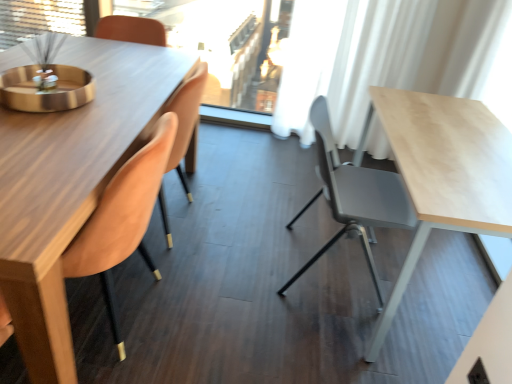
Locate an element on the screen. The width and height of the screenshot is (512, 384). vacant space that is in between matte gray chair at center, which is the 1th chair from right to left, and velvet orange chair at left, the 2th chair when ordered from right to left is located at coordinates (240, 294).